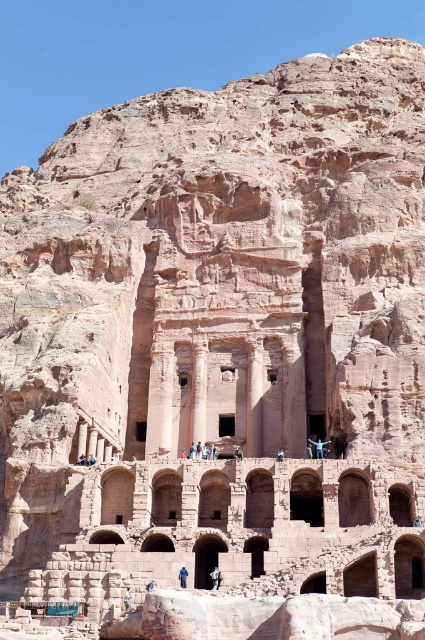
You are a tour guide leading a group through the ancient rock structure. You notice a dark brown leather jacket at center and a blue fabric person at center. Which object is taller?

The dark brown leather jacket at center is much taller than the blue fabric person at center.